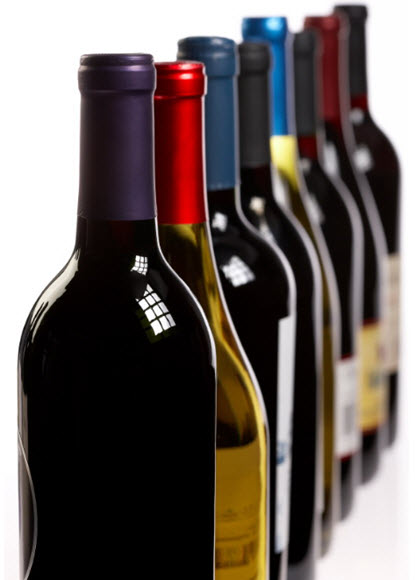
The image size is (415, 580). I want to click on wine bottles, so click(145, 425), click(240, 440), click(275, 337), click(301, 258), click(325, 287), click(347, 252), click(368, 252), click(386, 229).